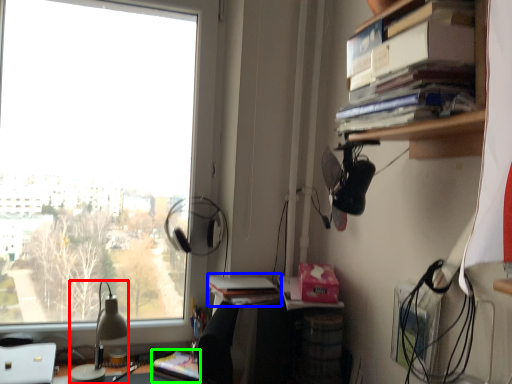
Question: Estimate the real-world distances between objects in this image. Which object is closer to lamp (highlighted by a red box), book (highlighted by a blue box) or paperback book (highlighted by a green box)?

Choices:
 (A) book
 (B) paperback book

Answer: (B)